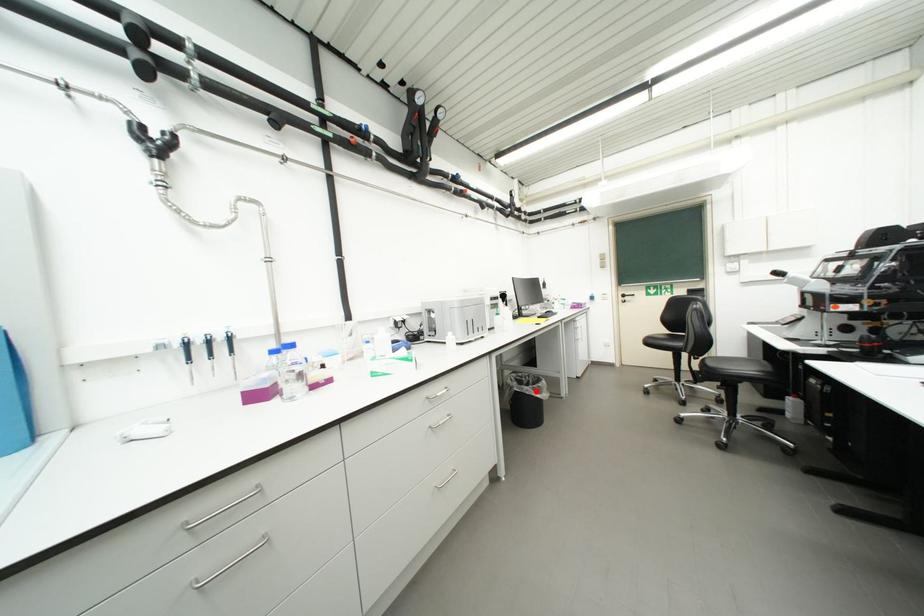
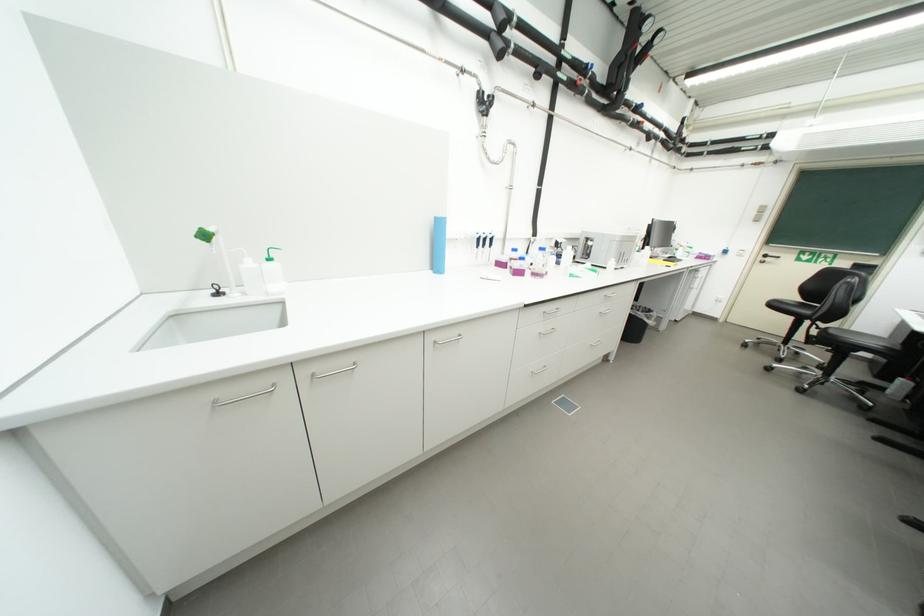
Where in the second image is the point corresponding to the highlighted location from the first image?

(649, 317)